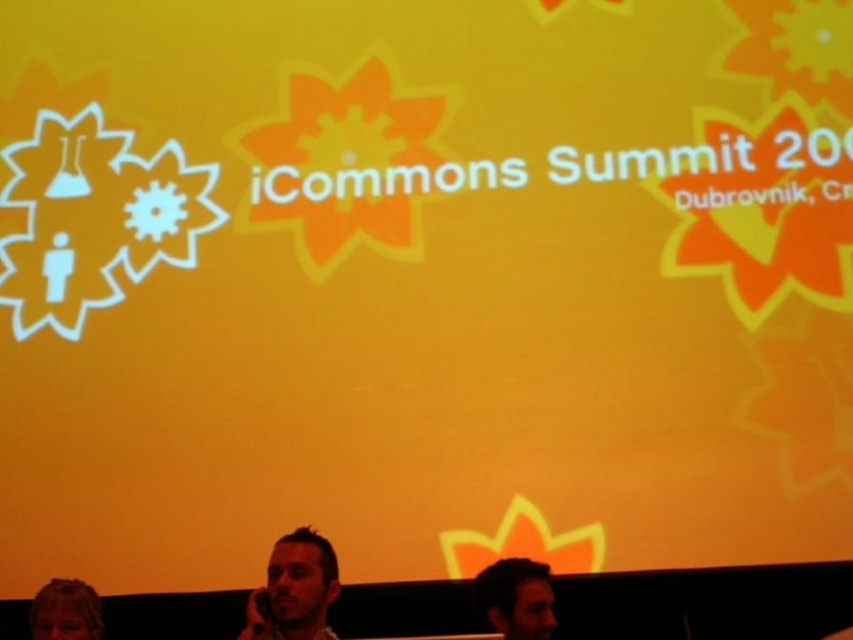
Can you confirm if smooth brown hair at lower left is positioned to the right of blonde hair at lower left?

Yes, smooth brown hair at lower left is to the right of blonde hair at lower left.

Does smooth brown hair at lower left have a lesser height compared to blonde hair at lower left?

Incorrect, smooth brown hair at lower left's height does not fall short of blonde hair at lower left's.

Identify the location of smooth brown hair at lower left. pos(294,589).

This screenshot has width=853, height=640. In order to click on smooth brown hair at lower left in this screenshot , I will do `click(294, 589)`.

Who is more distant from viewer, (498, 564) or (79, 616)?

Positioned behind is point (498, 564).

Which is behind, point (512, 596) or point (50, 602)?

Positioned behind is point (50, 602).

I want to click on dark brown hair at lower right, so click(515, 598).

Who is more forward, [312,628] or [505,628]?

Point [505,628] is more forward.

Which of these two, smooth brown hair at lower left or dark brown hair at lower right, stands taller?

With more height is smooth brown hair at lower left.

You are a GUI agent. You are given a task and a screenshot of the screen. Output one action in this format:
    pyautogui.click(x=<x>, y=<y>)
    Task: Click on the smooth brown hair at lower left
    The height and width of the screenshot is (640, 853).
    Given the screenshot: What is the action you would take?
    pyautogui.click(x=294, y=589)

The height and width of the screenshot is (640, 853). I want to click on smooth brown hair at lower left, so click(294, 589).